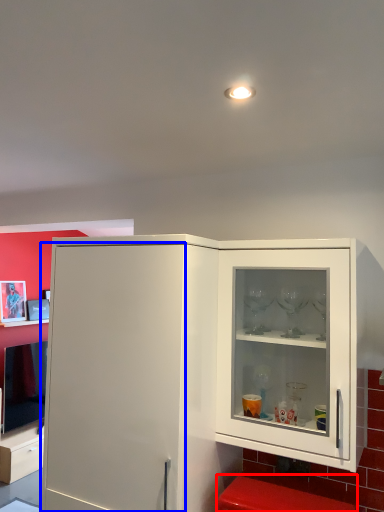
Question: Which object is further to the camera taking this photo, step stool (highlighted by a red box) or door (highlighted by a blue box)?

Choices:
 (A) step stool
 (B) door

Answer: (B)